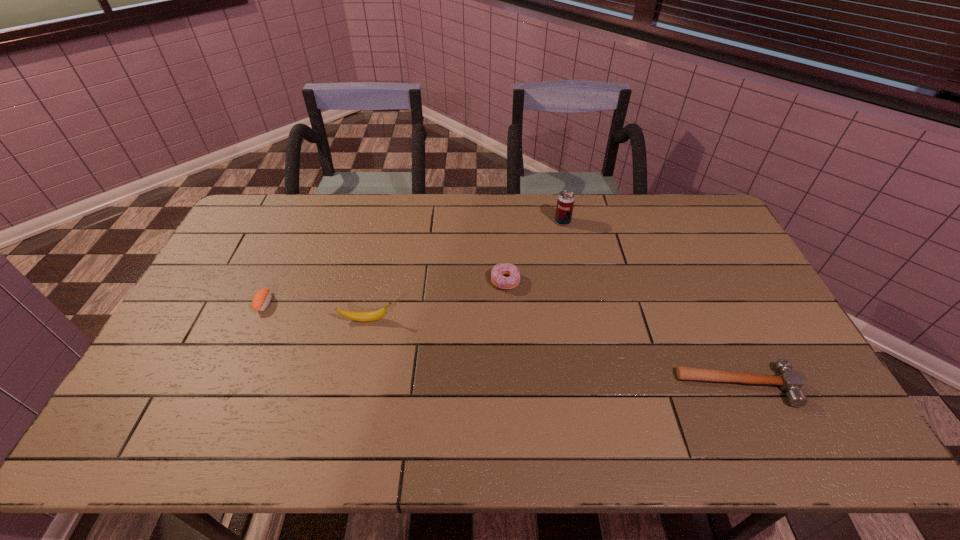
Image resolution: width=960 pixels, height=540 pixels. What are the coordinates of `object that ranks as the third closest to the beer can` in the screenshot? It's located at (368, 316).

You are a GUI agent. You are given a task and a screenshot of the screen. Output one action in this format:
    pyautogui.click(x=<x>, y=<y>)
    Task: Click on the object that is the closest to the doughnut
    
    Given the screenshot: What is the action you would take?
    pyautogui.click(x=565, y=203)

At what (x,y) coordinates should I click in order to perform the action: click on vacant space that satisfies the following two spatial constraints: 1. at the stem of the nearest object; 2. on the right side of the second object from left to right. Please return your answer as a coordinate pair (x, y). This screenshot has height=540, width=960. Looking at the image, I should click on (352, 386).

Where is `free region that satisfies the following two spatial constraints: 1. on the front side of the doughnut; 2. at the stem of the banana`? The width and height of the screenshot is (960, 540). free region that satisfies the following two spatial constraints: 1. on the front side of the doughnut; 2. at the stem of the banana is located at coordinates [x=508, y=320].